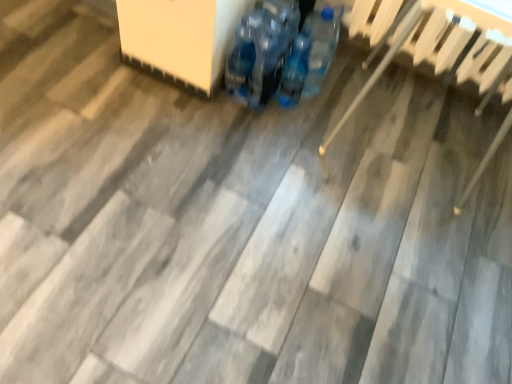
Question: Considering the positions of blue plastic bottles at center and wooden chair at right in the image, is blue plastic bottles at center taller or shorter than wooden chair at right?

Choices:
 (A) short
 (B) tall

Answer: (A)

Question: Based on their positions, is blue plastic bottles at center located to the left or right of wooden chair at right?

Choices:
 (A) left
 (B) right

Answer: (A)

Question: Based on their relative distances, which object is nearer to the wooden chair at right?

Choices:
 (A) blue plastic bottles at center
 (B) blue plastic bottles at center

Answer: (A)

Question: Estimate the real-world distances between objects in this image. Which object is farther from the blue plastic bottles at center?

Choices:
 (A) blue plastic bottles at center
 (B) wooden chair at right

Answer: (B)